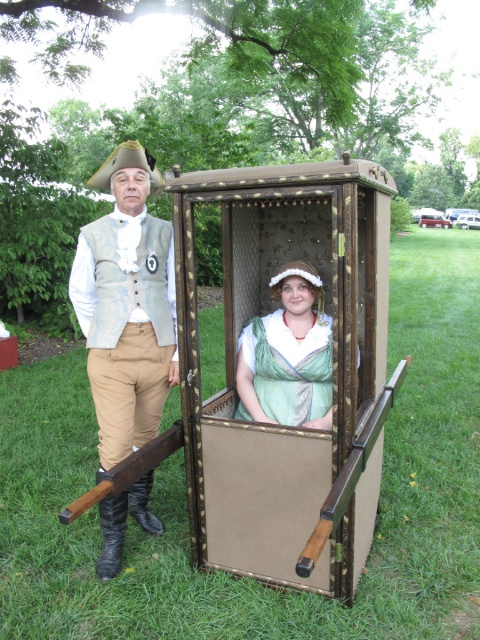
Question: From the image, what is the correct spatial relationship of wooden cage at center in relation to light brown leather vest at left?

Choices:
 (A) left
 (B) right

Answer: (B)

Question: Is wooden cage at center above green satin dress at center?

Choices:
 (A) yes
 (B) no

Answer: (A)

Question: Among these objects, which one is nearest to the camera?

Choices:
 (A) light brown leather vest at left
 (B) green satin dress at center
 (C) wooden cage at center

Answer: (C)

Question: Among these objects, which one is farthest from the camera?

Choices:
 (A) green satin dress at center
 (B) wooden cage at center

Answer: (A)

Question: Can you confirm if wooden cage at center is positioned to the right of light brown leather vest at left?

Choices:
 (A) no
 (B) yes

Answer: (B)

Question: Which is farther from the wooden cage at center?

Choices:
 (A) green satin dress at center
 (B) light brown leather vest at left

Answer: (B)